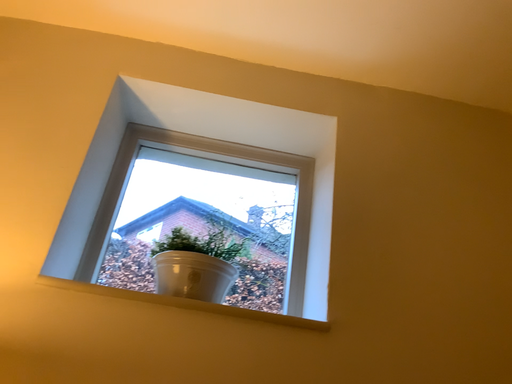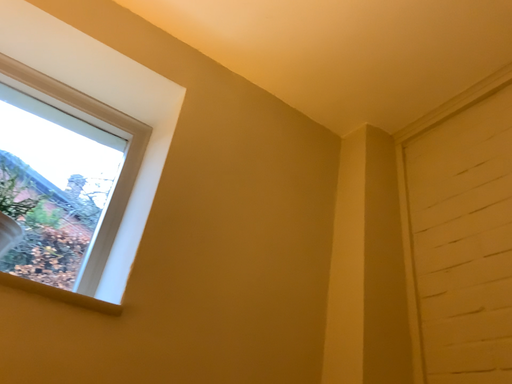
Question: Which way did the camera rotate in the video?

Choices:
 (A) rotated right
 (B) rotated left

Answer: (A)